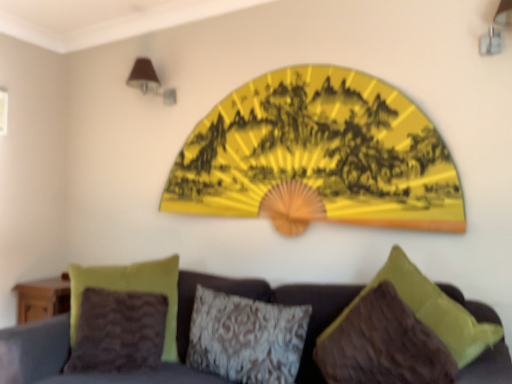
Question: From the image's perspective, relative to textured gray pillow at center, the second pillow when ordered from right to left, is velvet fabric couch at center above or below?

Choices:
 (A) below
 (B) above

Answer: (A)

Question: Based on their positions, is velvet fabric couch at center located to the left or right of textured gray pillow at center, the second pillow viewed from the left?

Choices:
 (A) left
 (B) right

Answer: (A)

Question: Estimate the real-world distances between objects in this image. Which object is closer to the brown fabric lampshade at upper left?

Choices:
 (A) textured gray pillow at center, the second pillow viewed from the left
 (B) velvet brown pillow at lower left, which is the 1th pillow from left to right
 (C) brown fuzzy pillow at lower right, marked as the 1th pillow in a right-to-left arrangement
 (D) velvet fabric couch at center
 (E) yellow paper fan at upper center

Answer: (E)

Question: Which of these objects is positioned closest to the yellow paper fan at upper center?

Choices:
 (A) brown fuzzy pillow at lower right, marked as the 1th pillow in a right-to-left arrangement
 (B) textured gray pillow at center, the second pillow viewed from the left
 (C) brown fabric lampshade at upper left
 (D) velvet brown pillow at lower left, the 3th pillow from the right
 (E) velvet fabric couch at center

Answer: (B)